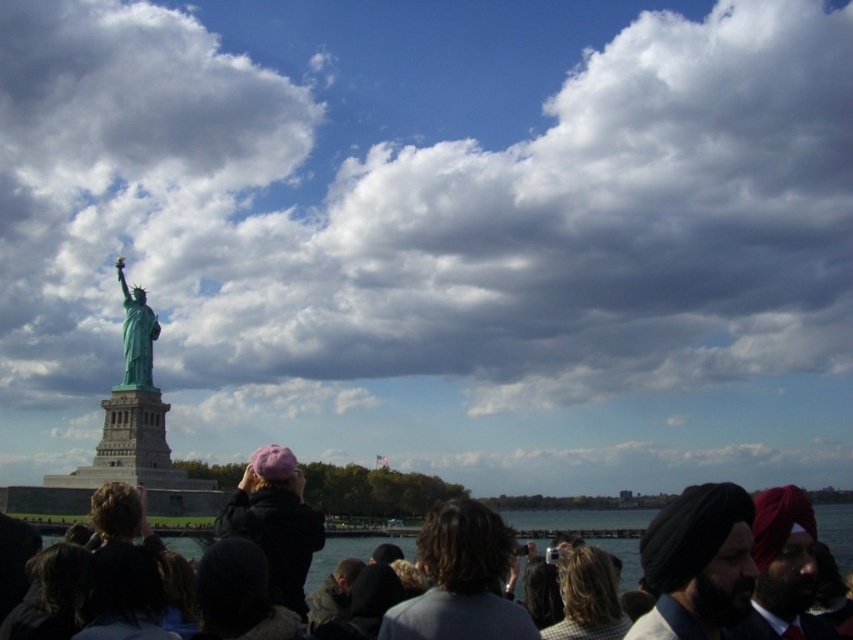
You are a photographer trying to capture the Statue of Liberty. You notice the cloudy sky at upper center and the green patina statue at center. Based on their positions, which object would appear closer to the camera in your photo?

The cloudy sky at upper center would appear closer to the camera because the green patina statue at center is behind it, meaning the statue is farther away.